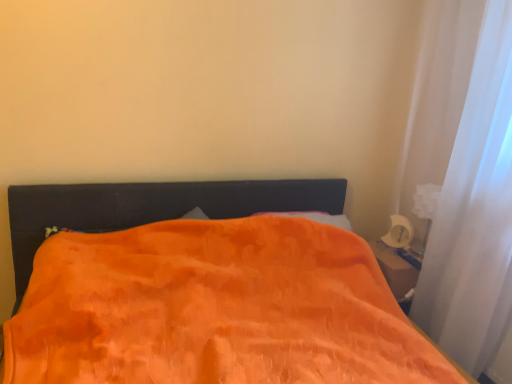
Question: Can orange soft blanket at center be found inside white sheer curtain at right?

Choices:
 (A) yes
 (B) no

Answer: (B)

Question: Is white sheer curtain at right located outside orange soft blanket at center?

Choices:
 (A) yes
 (B) no

Answer: (A)

Question: Does white sheer curtain at right have a greater width compared to orange soft blanket at center?

Choices:
 (A) no
 (B) yes

Answer: (A)

Question: Is white sheer curtain at right positioned before orange soft blanket at center?

Choices:
 (A) no
 (B) yes

Answer: (A)

Question: From a real-world perspective, is white sheer curtain at right physically below orange soft blanket at center?

Choices:
 (A) no
 (B) yes

Answer: (A)

Question: Does white sheer curtain at right appear on the left side of orange soft blanket at center?

Choices:
 (A) yes
 (B) no

Answer: (B)

Question: Does orange soft blanket at center appear on the right side of white sheer curtain at right?

Choices:
 (A) yes
 (B) no

Answer: (B)

Question: Does orange soft blanket at center have a larger size compared to white sheer curtain at right?

Choices:
 (A) no
 (B) yes

Answer: (B)

Question: Is orange soft blanket at center wider than white sheer curtain at right?

Choices:
 (A) yes
 (B) no

Answer: (A)

Question: Is orange soft blanket at center completely or partially outside of white sheer curtain at right?

Choices:
 (A) yes
 (B) no

Answer: (A)

Question: From a real-world perspective, is orange soft blanket at center on white sheer curtain at right?

Choices:
 (A) no
 (B) yes

Answer: (A)

Question: Is orange soft blanket at center taller than white sheer curtain at right?

Choices:
 (A) yes
 (B) no

Answer: (B)

Question: Which is correct: orange soft blanket at center is inside white sheer curtain at right, or outside of it?

Choices:
 (A) outside
 (B) inside

Answer: (A)